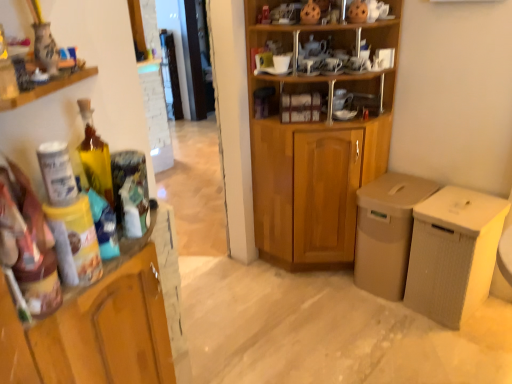
Question: Is translucent glass bottle at left not within wooden cabinet at center?

Choices:
 (A) no
 (B) yes

Answer: (B)

Question: Considering the relative positions of translucent glass bottle at left and wooden cabinet at center in the image provided, is translucent glass bottle at left to the left of wooden cabinet at center from the viewer's perspective?

Choices:
 (A) yes
 (B) no

Answer: (A)

Question: Does translucent glass bottle at left appear on the right side of wooden cabinet at center?

Choices:
 (A) yes
 (B) no

Answer: (B)

Question: Is the depth of translucent glass bottle at left less than that of wooden cabinet at center?

Choices:
 (A) yes
 (B) no

Answer: (A)

Question: Does translucent glass bottle at left have a smaller size compared to wooden cabinet at center?

Choices:
 (A) no
 (B) yes

Answer: (B)

Question: Choose the correct answer: Is matte ceramic vase at upper left inside translucent glass bottle at left or outside it?

Choices:
 (A) inside
 (B) outside

Answer: (B)

Question: Is matte ceramic vase at upper left wider or thinner than translucent glass bottle at left?

Choices:
 (A) thin
 (B) wide

Answer: (B)

Question: Considering their positions, is matte ceramic vase at upper left located in front of or behind translucent glass bottle at left?

Choices:
 (A) behind
 (B) front

Answer: (B)

Question: From the image's perspective, is matte ceramic vase at upper left located above or below translucent glass bottle at left?

Choices:
 (A) above
 (B) below

Answer: (A)

Question: Is wooden cabinet at center to the left or to the right of matte ceramic vase at upper left in the image?

Choices:
 (A) right
 (B) left

Answer: (A)

Question: In terms of height, does wooden cabinet at center look taller or shorter compared to matte ceramic vase at upper left?

Choices:
 (A) short
 (B) tall

Answer: (A)

Question: From a real-world perspective, is wooden cabinet at center positioned above or below matte ceramic vase at upper left?

Choices:
 (A) below
 (B) above

Answer: (A)

Question: Which is correct: wooden cabinet at center is inside matte ceramic vase at upper left, or outside of it?

Choices:
 (A) inside
 (B) outside

Answer: (B)

Question: From their relative heights in the image, would you say wooden cabinet at center is taller or shorter than wooden cupboard at center?

Choices:
 (A) tall
 (B) short

Answer: (B)

Question: Looking at the image, does wooden cabinet at center seem bigger or smaller compared to wooden cupboard at center?

Choices:
 (A) big
 (B) small

Answer: (B)